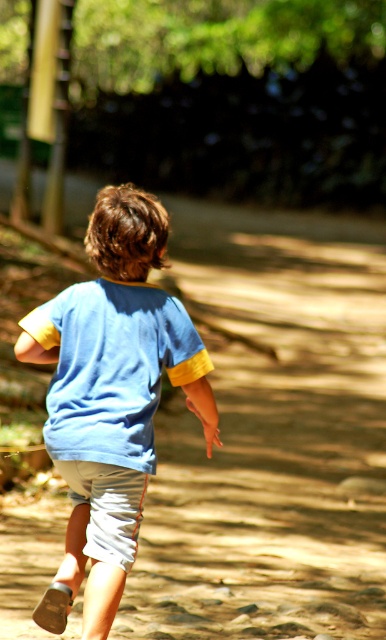
Question: Is blue cotton shirt at center positioned before white cotton shorts at lower center?

Choices:
 (A) no
 (B) yes

Answer: (B)

Question: Which of the following is the farthest from the observer?

Choices:
 (A) blue cotton shirt at center
 (B) white cotton shorts at lower center

Answer: (B)

Question: Does blue cotton shirt at center have a greater width compared to white cotton shorts at lower center?

Choices:
 (A) yes
 (B) no

Answer: (A)

Question: Is blue cotton shirt at center in front of white cotton shorts at lower center?

Choices:
 (A) no
 (B) yes

Answer: (B)